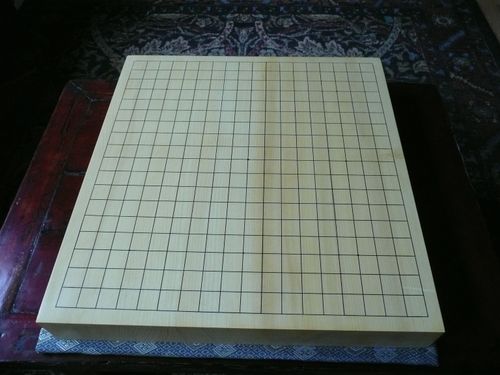
Locate an element on the screen. The height and width of the screenshot is (375, 500). wooden board is located at coordinates (234, 168).